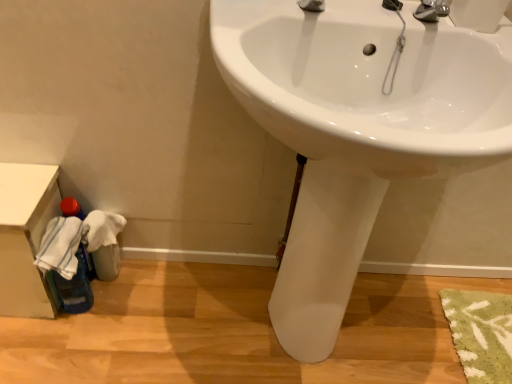
Question: Is white glossy sink at center located outside white plastic bin at lower left?

Choices:
 (A) no
 (B) yes

Answer: (B)

Question: Considering the relative positions of white glossy sink at center and white plastic bin at lower left in the image provided, is white glossy sink at center to the right of white plastic bin at lower left from the viewer's perspective?

Choices:
 (A) yes
 (B) no

Answer: (A)

Question: From a real-world perspective, is white glossy sink at center on white plastic bin at lower left?

Choices:
 (A) no
 (B) yes

Answer: (B)

Question: Can you confirm if white glossy sink at center is taller than white plastic bin at lower left?

Choices:
 (A) no
 (B) yes

Answer: (B)

Question: Could white plastic bin at lower left be considered to be inside white glossy sink at center?

Choices:
 (A) no
 (B) yes

Answer: (A)

Question: From the image's perspective, is white glossy sink at center on top of white plastic bin at lower left?

Choices:
 (A) no
 (B) yes

Answer: (B)

Question: Does white plastic bin at lower left have a smaller size compared to white glossy sink at center?

Choices:
 (A) no
 (B) yes

Answer: (B)

Question: From a real-world perspective, is white plastic bin at lower left located higher than white glossy sink at center?

Choices:
 (A) no
 (B) yes

Answer: (A)

Question: Can you confirm if white plastic bin at lower left is thinner than white glossy sink at center?

Choices:
 (A) yes
 (B) no

Answer: (A)

Question: Is white plastic bin at lower left facing away from white glossy sink at center?

Choices:
 (A) no
 (B) yes

Answer: (A)

Question: Could white glossy sink at center be considered to be inside white plastic bin at lower left?

Choices:
 (A) yes
 (B) no

Answer: (B)

Question: From the image's perspective, would you say white plastic bin at lower left is positioned over white glossy sink at center?

Choices:
 (A) yes
 (B) no

Answer: (B)

Question: From a real-world perspective, is white glossy sink at center above or below white plastic bin at lower left?

Choices:
 (A) below
 (B) above

Answer: (B)